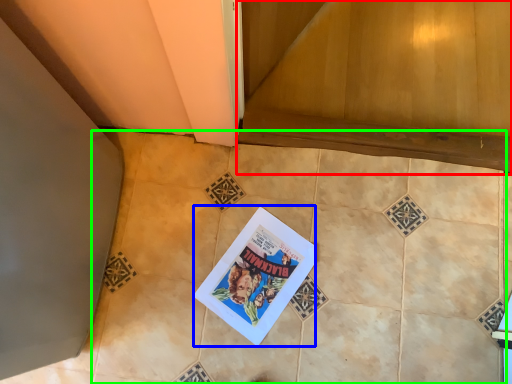
Question: Estimate the real-world distances between objects in this image. Which object is farther from stairwell (highlighted by a red box), comic book (highlighted by a blue box) or ceramic tile (highlighted by a green box)?

Choices:
 (A) comic book
 (B) ceramic tile

Answer: (A)